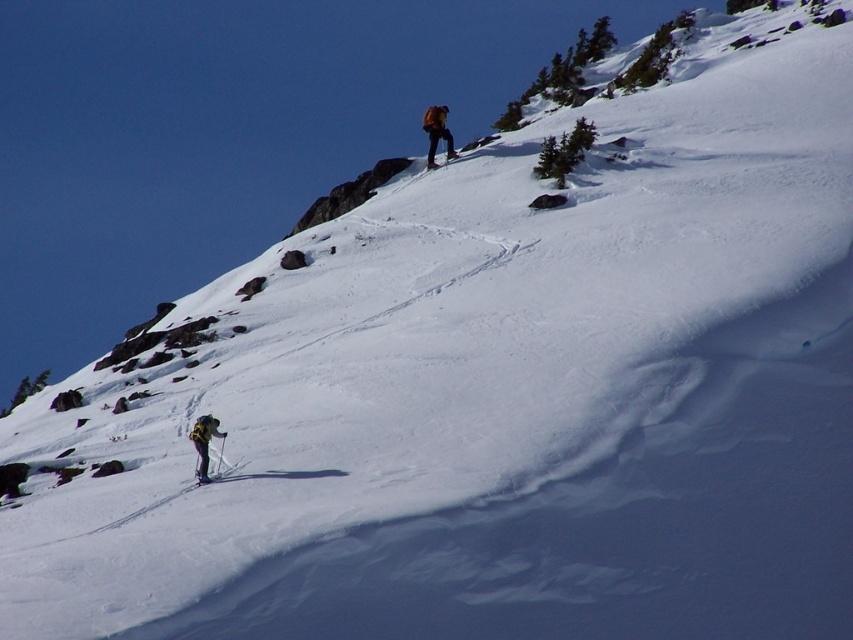
You are a hiker planning to reach the yellow fabric backpack at lower left. Given that the backpack is placed at coordinates 0.692 along the horizontal axis and 0.240 along the vertical axis, which direction should you move from your current position at the bottom of the slope to reach it?

The yellow fabric backpack at lower left is located at point 0.692 on the horizontal axis and 0.240 on the vertical axis. Since you are at the bottom of the slope, you should move towards the lower left direction to reach it, as the backpack is positioned to the left along the horizontal axis and lower along the vertical axis compared to your starting point.